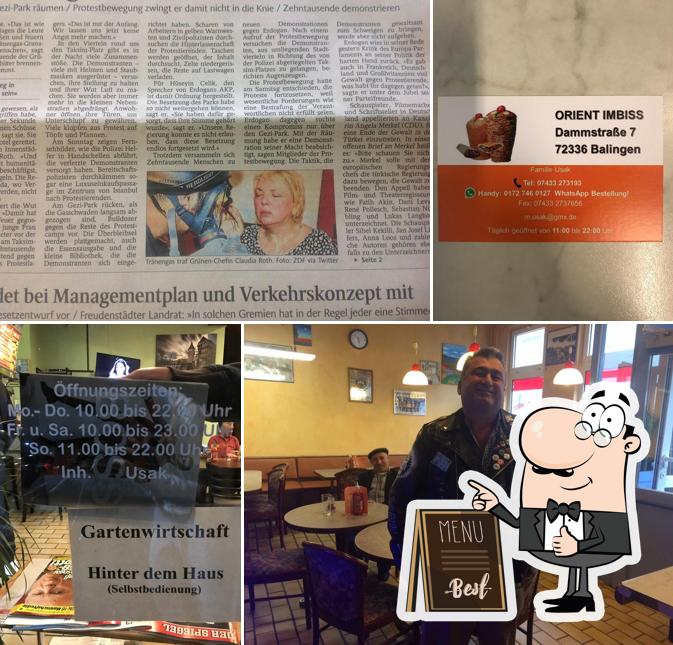
Where is `news paper`? The width and height of the screenshot is (673, 645). news paper is located at coordinates (79, 43), (314, 43), (373, 217), (54, 226).